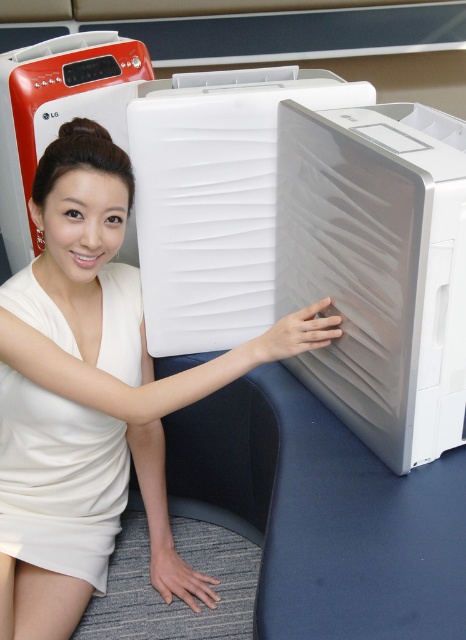
Question: Does satin white cooler at center appear on the right side of white satin dress at center?

Choices:
 (A) yes
 (B) no

Answer: (A)

Question: Which is nearer to the white satin dress at center?

Choices:
 (A) satin white cooler at center
 (B) white matte air purifier at center

Answer: (B)

Question: Which object is farther from the camera taking this photo?

Choices:
 (A) satin white cooler at center
 (B) white satin dress at center

Answer: (B)

Question: Is satin white cooler at center above white satin dress at center?

Choices:
 (A) no
 (B) yes

Answer: (B)

Question: Can you confirm if white matte air purifier at center is positioned to the right of white satin dress at center?

Choices:
 (A) yes
 (B) no

Answer: (A)

Question: Which of the following is the farthest from the observer?

Choices:
 (A) satin white cooler at center
 (B) white satin dress at center

Answer: (B)